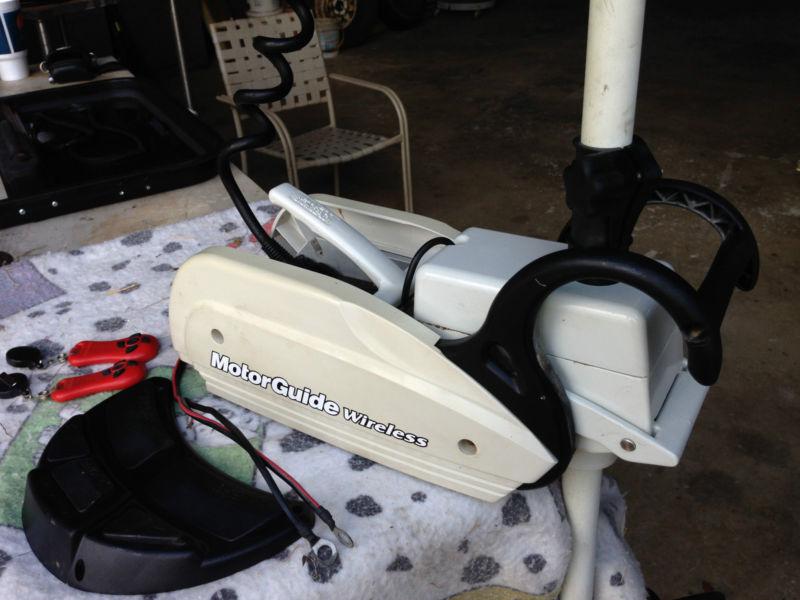
The width and height of the screenshot is (800, 600). Find the location of `chair`. chair is located at coordinates (314, 88).